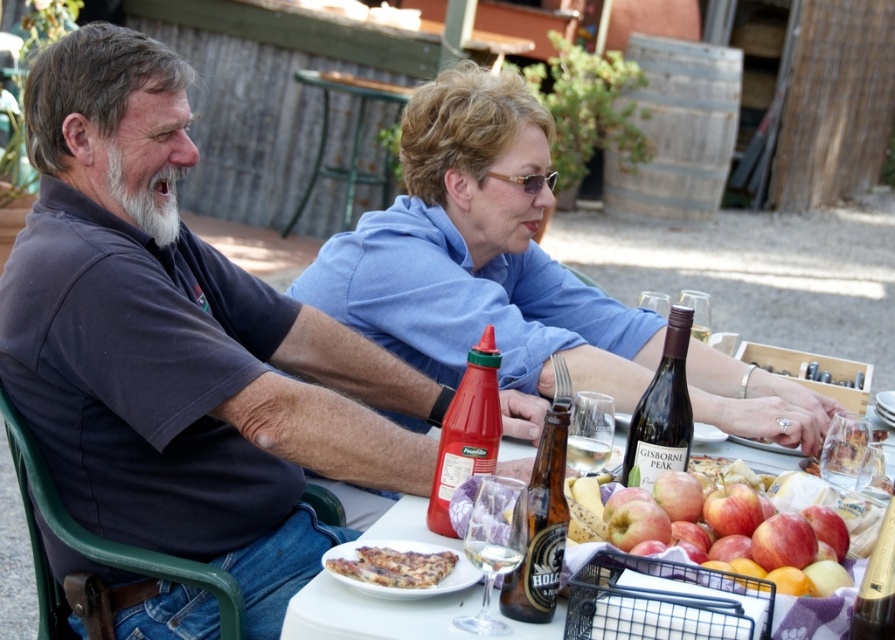
You are a photographer standing at the edge of the scene wanting to capture a closeup of the blue cotton shirt at center. Based on its position coordinates, where should you aim your camera?

The blue cotton shirt at center is located at coordinates point (478, 253). To capture a closeup, aim your camera towards that specific coordinate point.

You are a waiter at this outdoor dining table and need to place a new drink order for the couple. The drink needs to be placed exactly where the red matte apple at center is currently located. Can you confirm the exact coordinates where you should place the drink?

The red matte apple at center is located at point (727, 529), so you should place the drink at those coordinates.